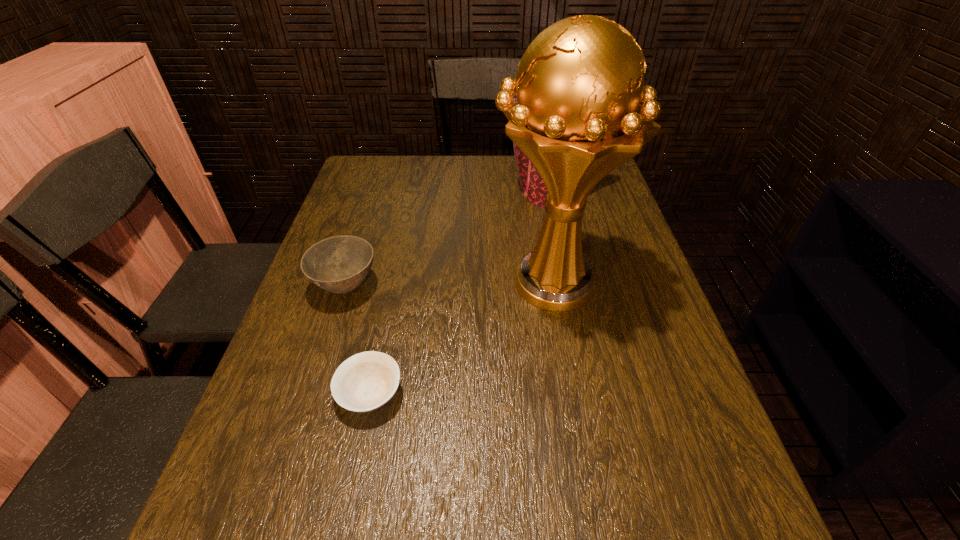
You are a GUI agent. You are given a task and a screenshot of the screen. Output one action in this format:
    pyautogui.click(x=<x>, y=<y>)
    Task: Click on the vacant space situated 0.390m on the front of the farthest object
    Image resolution: width=960 pixels, height=540 pixels.
    Given the screenshot: What is the action you would take?
    pyautogui.click(x=572, y=303)

Locate an element on the screen. vacant space located on the right of the farther bowl is located at coordinates 482,287.

I want to click on vacant area situated 0.140m on the left of the shorter bowl, so click(x=265, y=394).

You are a GUI agent. You are given a task and a screenshot of the screen. Output one action in this format:
    pyautogui.click(x=<x>, y=<y>)
    Task: Click on the object that is at the far edge
    The height and width of the screenshot is (540, 960).
    Given the screenshot: What is the action you would take?
    pyautogui.click(x=533, y=187)

At what (x,y) coordinates should I click in order to perform the action: click on trophy_cup at the right edge. Please return your answer as a coordinate pair (x, y). The width and height of the screenshot is (960, 540). Looking at the image, I should click on (582, 110).

Where is `handbag at the right edge`? Image resolution: width=960 pixels, height=540 pixels. handbag at the right edge is located at coordinates (533, 187).

Where is `object located at the far right corner`? The image size is (960, 540). object located at the far right corner is located at coordinates (533, 187).

Find the location of a particular element. Image resolution: width=960 pixels, height=540 pixels. vacant space at the far edge of the desktop is located at coordinates (459, 157).

Image resolution: width=960 pixels, height=540 pixels. I want to click on free space at the left edge of the desktop, so click(x=243, y=432).

The height and width of the screenshot is (540, 960). What are the coordinates of `blank space at the right edge` in the screenshot? It's located at (644, 379).